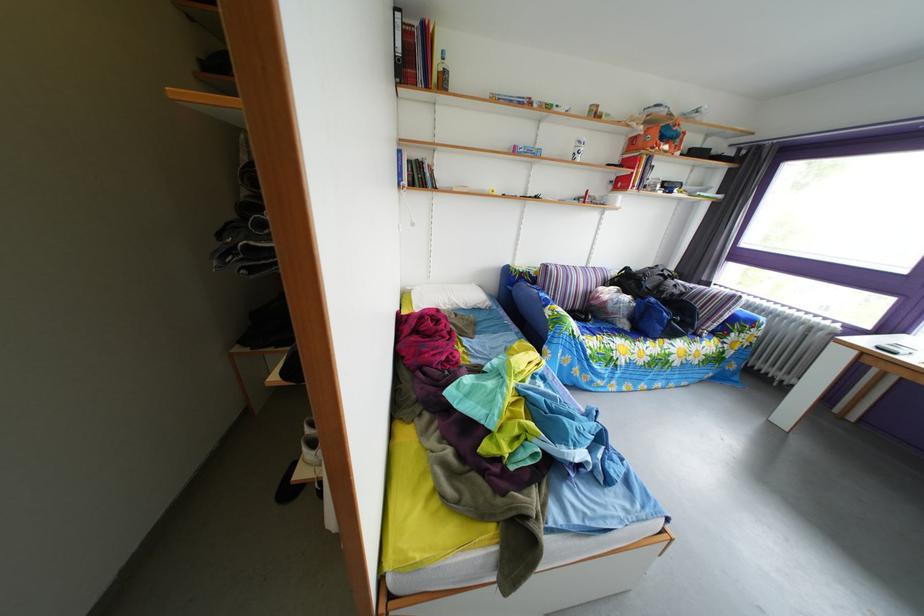
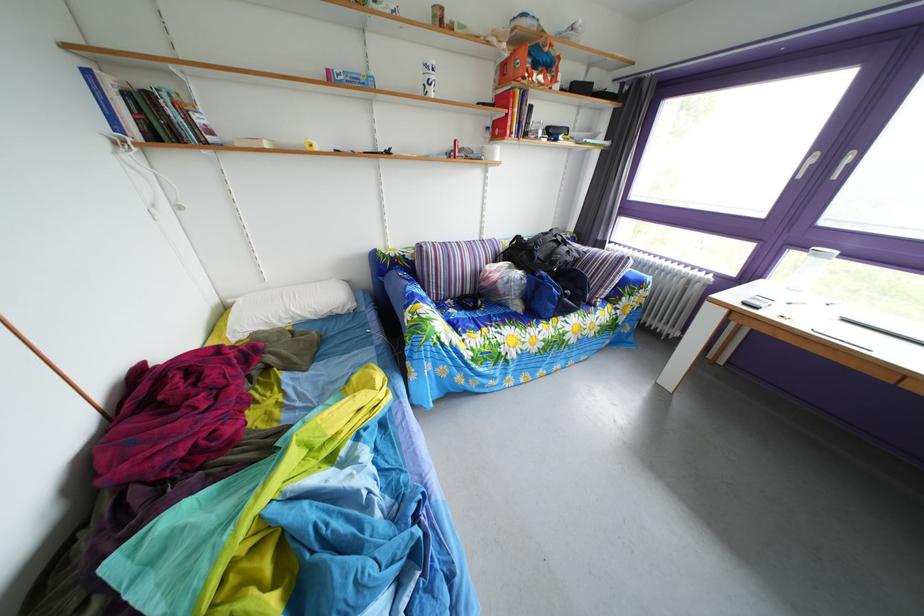
Question: The first image is from the beginning of the video and the second image is from the end. How did the camera likely rotate when shooting the video?

Choices:
 (A) Left
 (B) Right
 (C) Up
 (D) Down

Answer: (B)